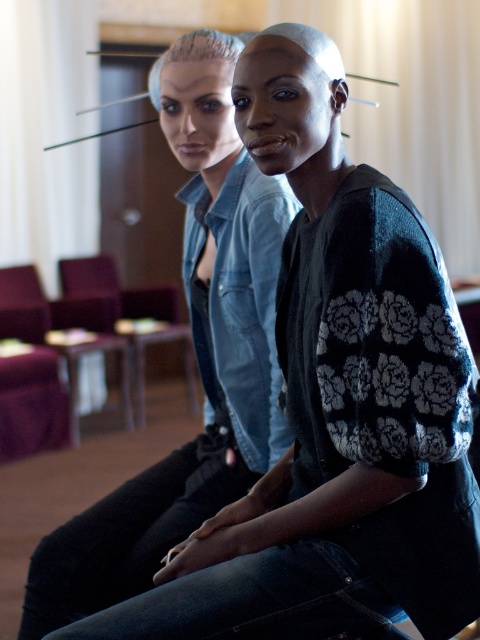
Measure the distance from denim jacket at center to purple fabric armchair at center.

3.45 meters

Which is in front, point (23, 624) or point (168, 328)?

Point (23, 624) is more forward.

This screenshot has width=480, height=640. Identify the location of denim jacket at center. coord(195,353).

Is denim jacket at center bigger than purple fabric armchair at lower left?

Incorrect, denim jacket at center is not larger than purple fabric armchair at lower left.

Which of these two, denim jacket at center or purple fabric armchair at lower left, stands taller?

denim jacket at center is taller.

Who is more forward, (x=210, y=464) or (x=132, y=420)?

Point (x=210, y=464) is more forward.

Find the location of a particular element. The image size is (480, 640). denim jacket at center is located at coordinates (195, 353).

Does purple fabric armchair at center have a lesser width compared to purple fabric armchair at lower left?

No.

At what (x,y) coordinates should I click in order to perform the action: click on purple fabric armchair at center. Please return your answer as a coordinate pair (x, y). Looking at the image, I should click on (122, 316).